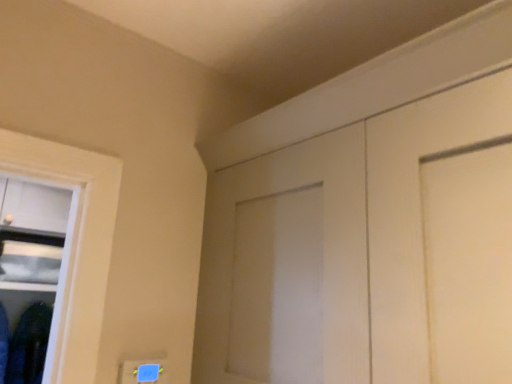
Question: From a real-world perspective, is white matte door at upper right beneath dark blue fabric at lower left?

Choices:
 (A) yes
 (B) no

Answer: (B)

Question: Can you confirm if white matte door at upper right is wider than dark blue fabric at lower left?

Choices:
 (A) no
 (B) yes

Answer: (B)

Question: Is white matte door at upper right at the right side of dark blue fabric at lower left?

Choices:
 (A) yes
 (B) no

Answer: (A)

Question: Considering the relative sizes of white matte door at upper right and dark blue fabric at lower left in the image provided, is white matte door at upper right thinner than dark blue fabric at lower left?

Choices:
 (A) no
 (B) yes

Answer: (A)

Question: Is the depth of white matte door at upper right less than that of dark blue fabric at lower left?

Choices:
 (A) yes
 (B) no

Answer: (A)

Question: Could you tell me if white matte door at upper right is facing dark blue fabric at lower left?

Choices:
 (A) no
 (B) yes

Answer: (A)

Question: Is dark blue fabric at lower left far from white matte door at upper right?

Choices:
 (A) yes
 (B) no

Answer: (A)

Question: Considering the relative sizes of dark blue fabric at lower left and white matte door at upper right in the image provided, is dark blue fabric at lower left shorter than white matte door at upper right?

Choices:
 (A) yes
 (B) no

Answer: (A)

Question: From the image's perspective, would you say dark blue fabric at lower left is shown under white matte door at upper right?

Choices:
 (A) no
 (B) yes

Answer: (B)

Question: Is white matte door at upper right located within dark blue fabric at lower left?

Choices:
 (A) yes
 (B) no

Answer: (B)

Question: Could you tell me if dark blue fabric at lower left is turned towards white matte door at upper right?

Choices:
 (A) yes
 (B) no

Answer: (A)

Question: Is dark blue fabric at lower left positioned beyond the bounds of white matte door at upper right?

Choices:
 (A) yes
 (B) no

Answer: (A)

Question: Considering their positions, is dark blue fabric at lower left located in front of or behind white matte door at upper right?

Choices:
 (A) front
 (B) behind

Answer: (B)